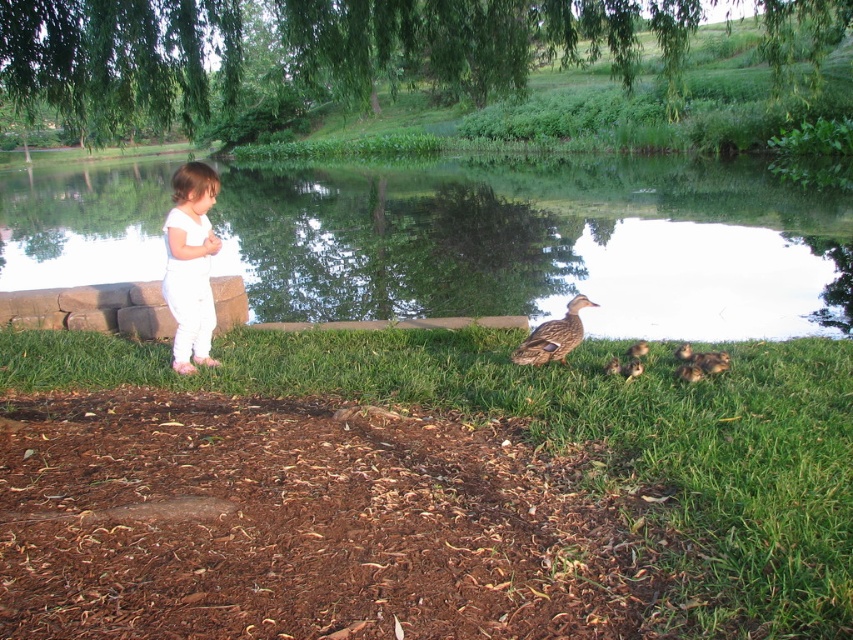
Question: Which object appears closest to the camera in this image?

Choices:
 (A) green leafy willow at upper center
 (B) brown fuzzy duckling at lower center

Answer: (B)

Question: Is green leafy willow at upper center thinner than brown matte duck at center?

Choices:
 (A) yes
 (B) no

Answer: (B)

Question: Considering the relative positions of brown matte duck at center and brown fuzzy duckling at lower center in the image provided, where is brown matte duck at center located with respect to brown fuzzy duckling at lower center?

Choices:
 (A) left
 (B) right

Answer: (A)

Question: Does brown matte duck at center have a lesser width compared to brown fuzzy ducklings at lower right?

Choices:
 (A) no
 (B) yes

Answer: (A)

Question: Which point is farther to the camera?

Choices:
 (A) brown matte duck at center
 (B) brown fuzzy ducklings at lower right
 (C) green reflective water at center

Answer: (C)

Question: Based on their relative distances, which object is farther from the white cotton onesie at left?

Choices:
 (A) green reflective water at center
 (B) brown matte duck at center
 (C) brown fuzzy ducklings at lower right
 (D) green leafy willow at upper center

Answer: (D)